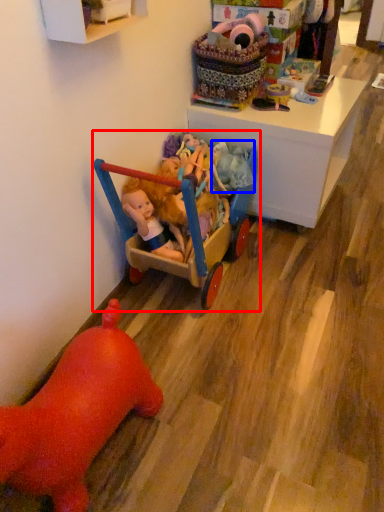
Question: Which of the following is the closest to the observer, toy (highlighted by a red box) or toy (highlighted by a blue box)?

Choices:
 (A) toy
 (B) toy

Answer: (A)